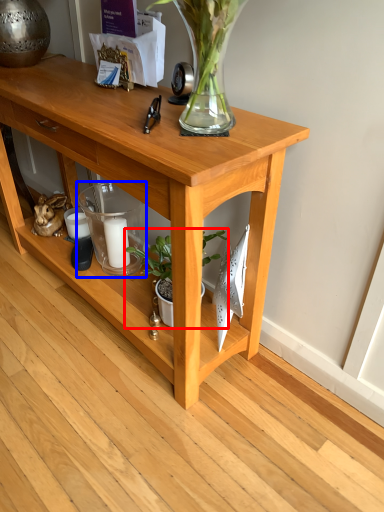
Question: Which of the following is the closest to the observer, houseplant (highlighted by a red box) or candle holder (highlighted by a blue box)?

Choices:
 (A) houseplant
 (B) candle holder

Answer: (A)